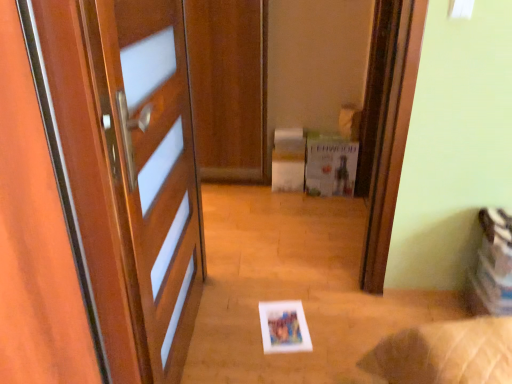
Question: From the image's perspective, is white paper postcard at center beneath transparent glass screen door at upper center?

Choices:
 (A) yes
 (B) no

Answer: (A)

Question: Is white paper postcard at center to the right of transparent glass screen door at upper center from the viewer's perspective?

Choices:
 (A) yes
 (B) no

Answer: (B)

Question: Considering the relative sizes of white paper postcard at center and transparent glass screen door at upper center in the image provided, is white paper postcard at center bigger than transparent glass screen door at upper center?

Choices:
 (A) yes
 (B) no

Answer: (B)

Question: Does white paper postcard at center lie behind transparent glass screen door at upper center?

Choices:
 (A) no
 (B) yes

Answer: (B)

Question: Does white paper postcard at center have a greater height compared to transparent glass screen door at upper center?

Choices:
 (A) yes
 (B) no

Answer: (B)

Question: From the image's perspective, is white paper postcard at center over transparent glass screen door at upper center?

Choices:
 (A) no
 (B) yes

Answer: (A)

Question: Is transparent glass screen door at upper center closer to camera compared to white paper postcard at center?

Choices:
 (A) no
 (B) yes

Answer: (B)

Question: Is transparent glass screen door at upper center taller than white paper postcard at center?

Choices:
 (A) no
 (B) yes

Answer: (B)

Question: Is there a large distance between transparent glass screen door at upper center and white paper postcard at center?

Choices:
 (A) yes
 (B) no

Answer: (A)

Question: Is transparent glass screen door at upper center turned away from white paper postcard at center?

Choices:
 (A) no
 (B) yes

Answer: (B)

Question: Is transparent glass screen door at upper center further to camera compared to white paper postcard at center?

Choices:
 (A) no
 (B) yes

Answer: (A)

Question: Is white paper postcard at center a part of transparent glass screen door at upper center?

Choices:
 (A) yes
 (B) no

Answer: (B)

Question: In the image, is white paper postcard at center on the left side or the right side of transparent glass screen door at upper center?

Choices:
 (A) left
 (B) right

Answer: (A)